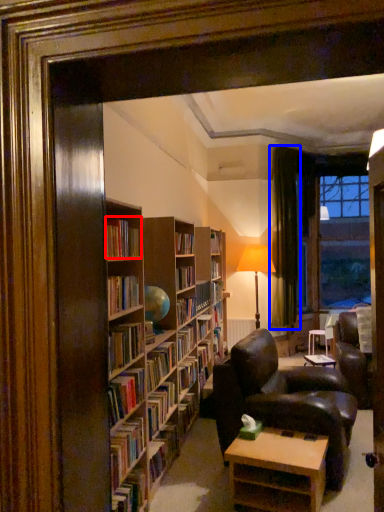
Question: Which object is further to the camera taking this photo, book (highlighted by a red box) or curtain (highlighted by a blue box)?

Choices:
 (A) book
 (B) curtain

Answer: (B)